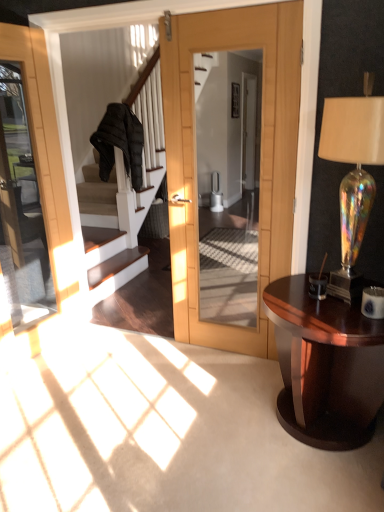
Locate an element on the screen. vacant area that is in front of iridescent glass lamp at right is located at coordinates (341, 322).